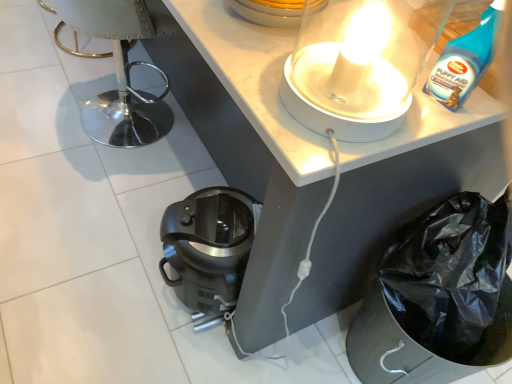
Locate an element on the screen. The image size is (512, 384). free space in front of metallic silver swivel chair at left is located at coordinates (84, 180).